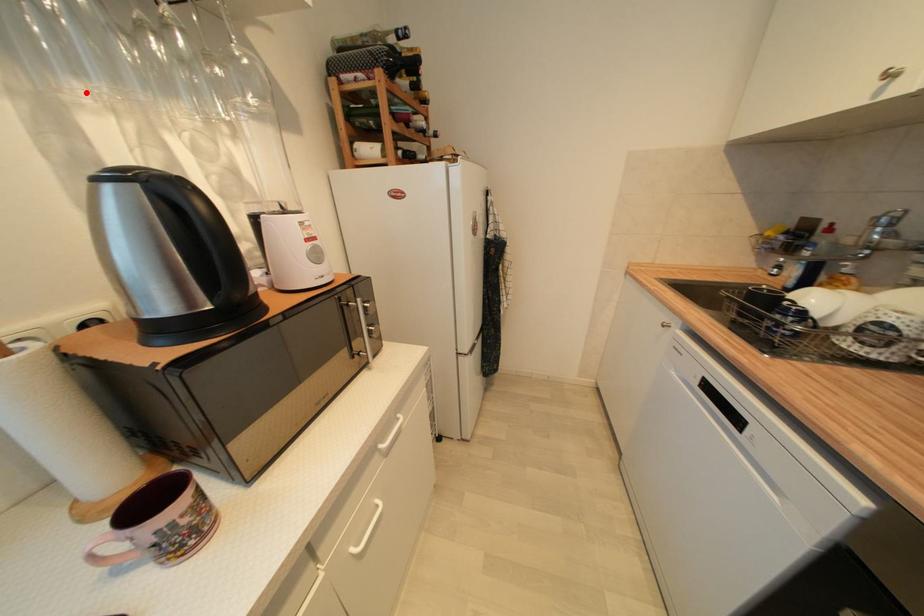
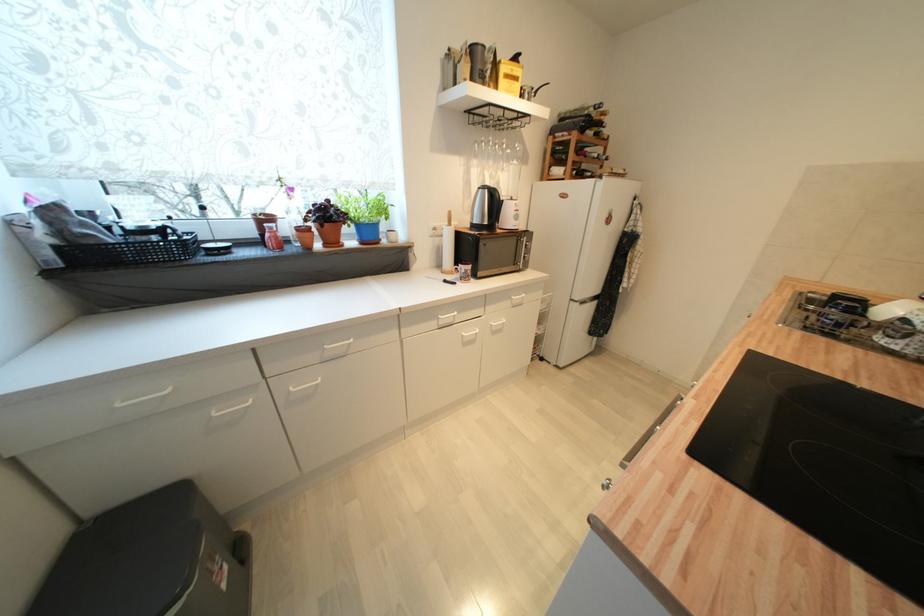
The point at the highlighted location is marked in the first image. Where is the corresponding point in the second image?

(480, 164)